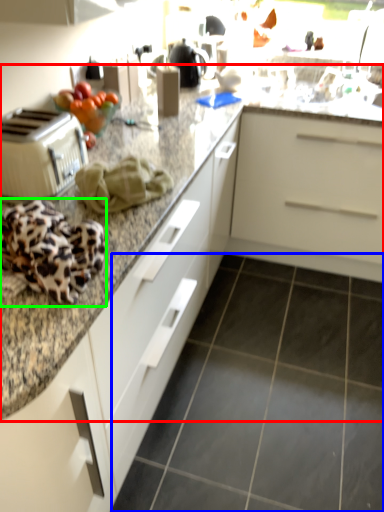
Question: Which object is the farthest from countertop (highlighted by a red box)? Choose among these: granite (highlighted by a blue box) or blanket (highlighted by a green box).

Choices:
 (A) granite
 (B) blanket

Answer: (A)